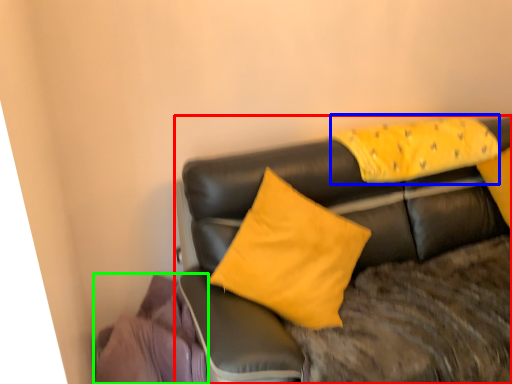
Question: Which object is positioned farthest from studio couch (highlighted by a red box)? Select from pillow (highlighted by a blue box) and material (highlighted by a green box).

Choices:
 (A) pillow
 (B) material

Answer: (B)